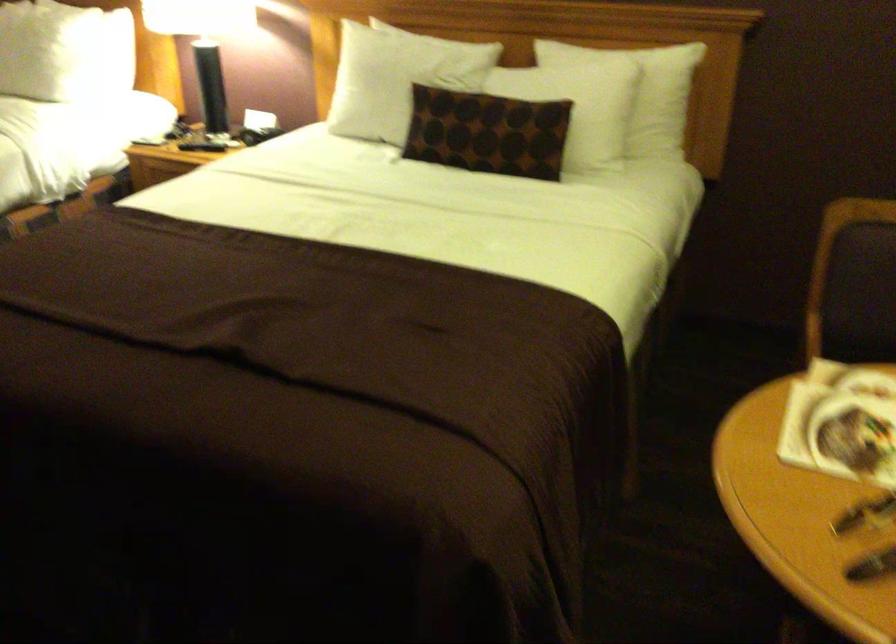
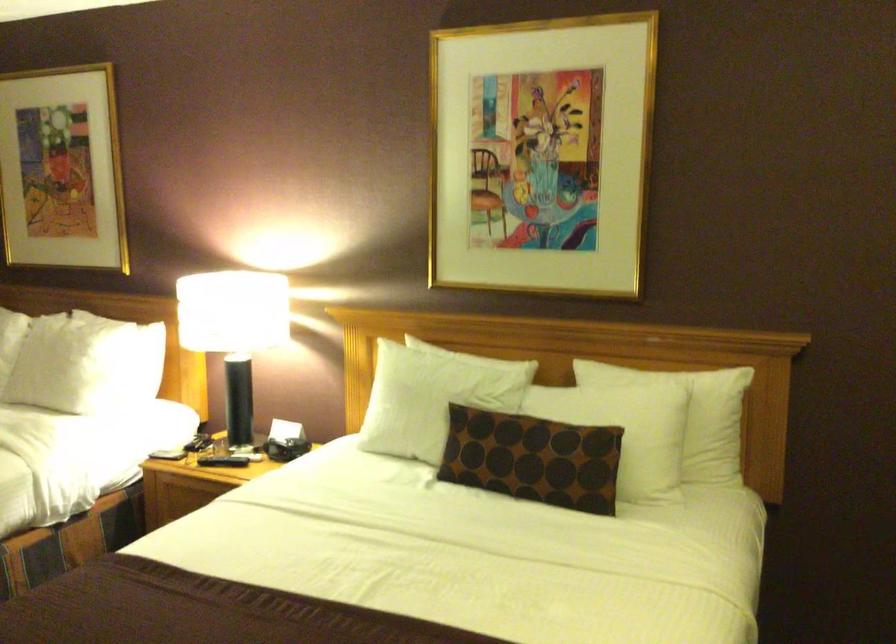
Question: The images are taken continuously from a first-person perspective. In which direction is your viewpoint rotating?

Choices:
 (A) Left
 (B) Right
 (C) Up
 (D) Down

Answer: (C)